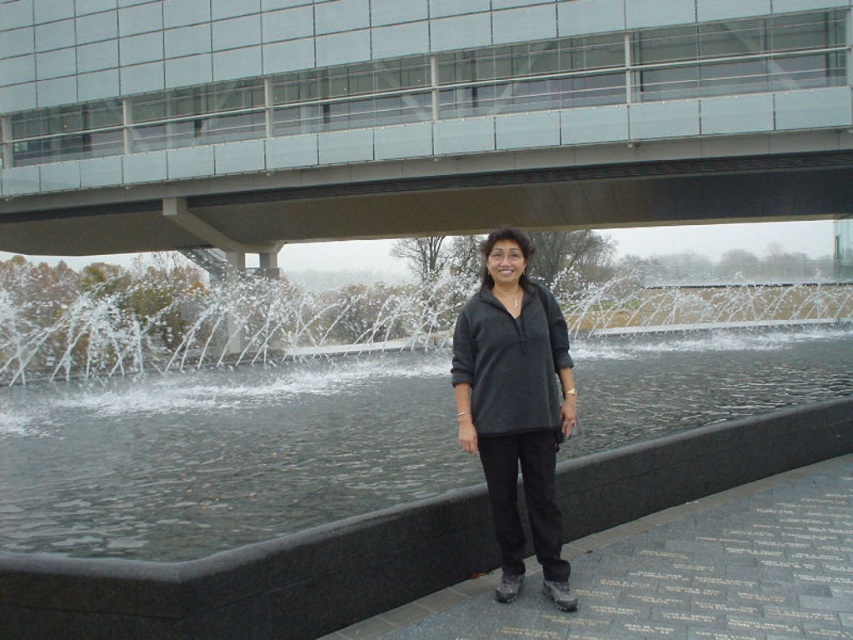
You are a photographer planning to capture a shot of the clear water at center and the dark gray fleece at center. Since you want to emphasize the size difference between them, which object should you focus on to highlight the larger one?

The clear water at center is larger in size compared to the dark gray fleece at center, so focusing on the clear water at center will effectively highlight the larger object.

You are standing at the point closer to you in the scene. Which point are you at, point (6, 472) or point (525, 404)?

You are at point (6, 472) because it is further to the viewer than point (525, 404).